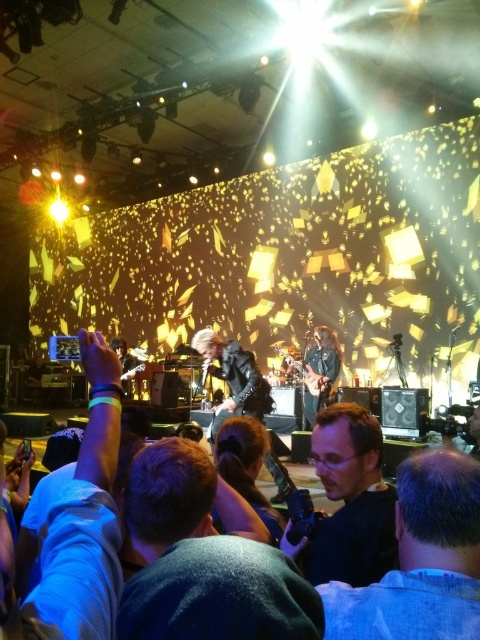
Is dark blue shirt at lower right wider than leather jacket at center?

No, dark blue shirt at lower right is not wider than leather jacket at center.

Is dark blue shirt at lower right thinner than leather jacket at center?

Correct, dark blue shirt at lower right's width is less than leather jacket at center's.

What do you see at coordinates (421, 560) in the screenshot? The height and width of the screenshot is (640, 480). I see `dark blue shirt at lower right` at bounding box center [421, 560].

Find the location of `dark blue shirt at lower right`. dark blue shirt at lower right is located at coordinates (421, 560).

Is dark blue shirt at lower right to the right of dark blue shirt at center from the viewer's perspective?

Yes, dark blue shirt at lower right is to the right of dark blue shirt at center.

This screenshot has width=480, height=640. What do you see at coordinates (421, 560) in the screenshot? I see `dark blue shirt at lower right` at bounding box center [421, 560].

Identify the location of dark blue shirt at lower right. (421, 560).

The width and height of the screenshot is (480, 640). Describe the element at coordinates (84, 518) in the screenshot. I see `white fabric shirt at left` at that location.

Image resolution: width=480 pixels, height=640 pixels. I want to click on white fabric shirt at left, so click(x=84, y=518).

Image resolution: width=480 pixels, height=640 pixels. In order to click on white fabric shirt at left in this screenshot , I will do `click(84, 518)`.